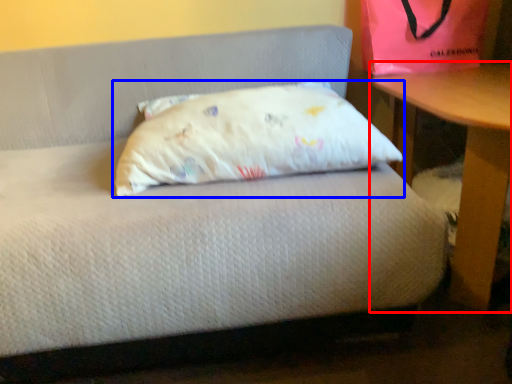
Question: Which of the following is the farthest to the observer, table (highlighted by a red box) or pillow (highlighted by a blue box)?

Choices:
 (A) table
 (B) pillow

Answer: (B)